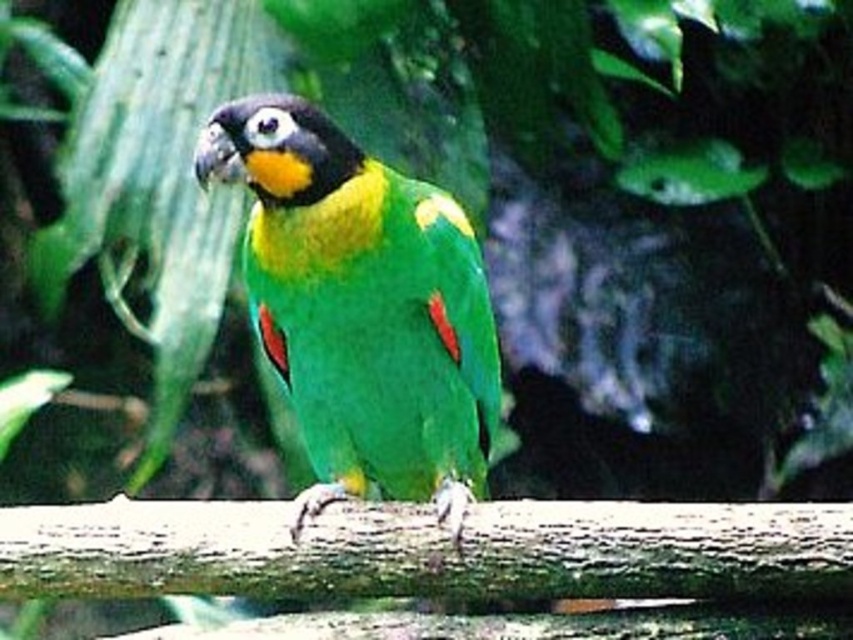
You are a wildlife photographer trying to capture a closeup of the green matte parrot at center. The brown rough branch at center is blocking part of the parrot. Can you adjust your position to get a clear shot without moving the branch?

The green matte parrot at center is larger than the brown rough branch at center, so you can position yourself to frame the parrot around the smaller branch, ensuring the parrot remains the focus while avoiding the obstruction.

You are standing in a tropical forest and see a parrot perched on a branch. There is a point at coordinates point (265, 211) that you want to reach. If you can only move forward in a straight line, will you collide with the parrot before reaching that point?

The point (265, 211) is 7.23 feet away from the camera. Since the parrot is perched on a branch in the tropical forest, it is likely positioned between you and the point, so moving straight forward might cause a collision with the parrot before reaching the point.